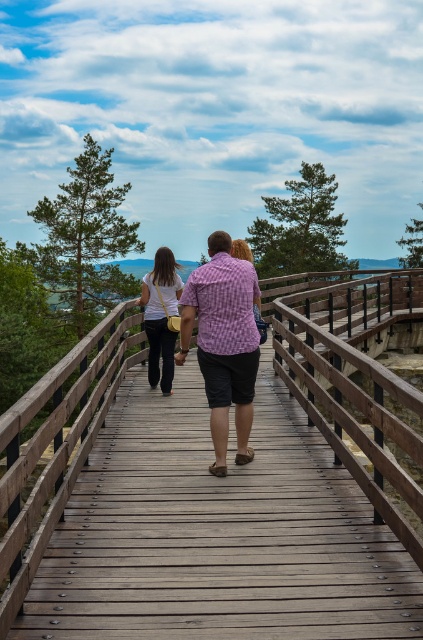
You are standing at the starting point of the boardwalk and see two points marked on the path ahead. The first point is at coordinates point (231, 259), and the second is at point (161, 384). Which point is closer to you?

Point (231, 259) is in front of point (161, 384), so the first point is closer to you.

You are a photographer trying to capture the two people in the scene. Since the pink checkered shirt at center and the matte white shirt at center are both at the center, which one do you need to adjust your camera angle upwards to focus on?

The pink checkered shirt at center has a greater height compared to matte white shirt at center, so you need to adjust your camera angle upwards to focus on the pink checkered shirt at center.